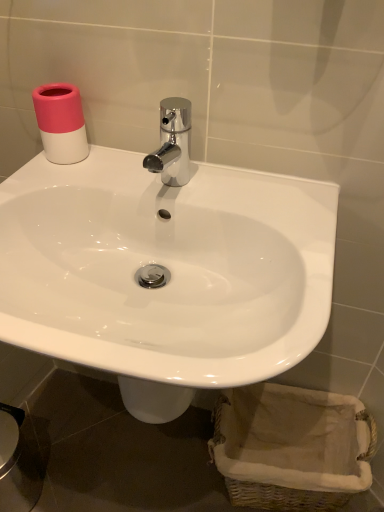
This screenshot has height=512, width=384. Find the location of `vacant area that is in front of pink matte toilet paper at upper left`. vacant area that is in front of pink matte toilet paper at upper left is located at coordinates (61, 177).